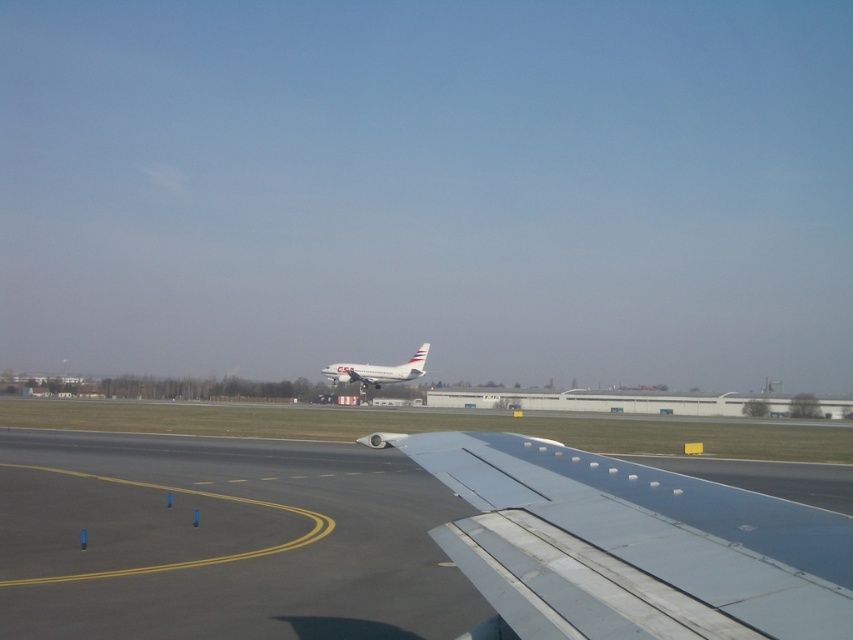
Can you confirm if smooth asphalt tarmac at lower center is positioned to the right of white matte airplane at center?

Indeed, smooth asphalt tarmac at lower center is positioned on the right side of white matte airplane at center.

Which is more to the left, smooth asphalt tarmac at lower center or white matte airplane at center?

From the viewer's perspective, white matte airplane at center appears more on the left side.

I want to click on smooth asphalt tarmac at lower center, so click(404, 544).